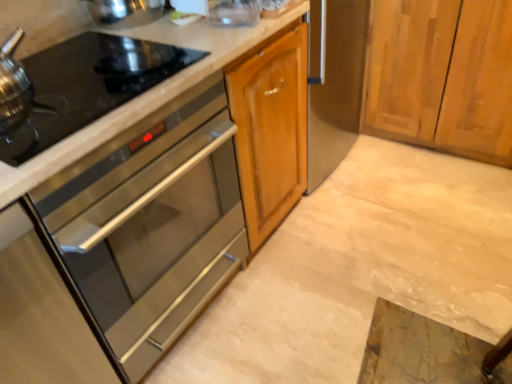
Locate an element on the screen. The height and width of the screenshot is (384, 512). free spot above marble countertop at center (from a real-world perspective) is located at coordinates (371, 236).